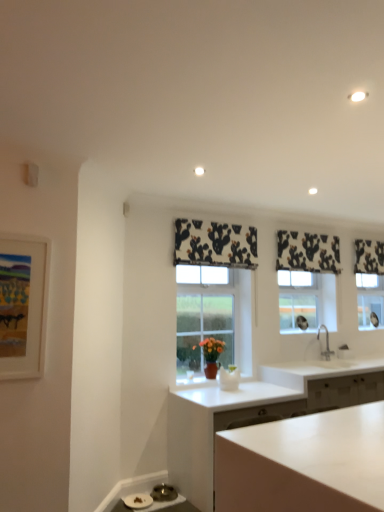
Question: From the image's perspective, is silver metallic faucet at right above matte white picture frame at left?

Choices:
 (A) yes
 (B) no

Answer: (B)

Question: Is silver metallic faucet at right positioned before matte white picture frame at left?

Choices:
 (A) yes
 (B) no

Answer: (B)

Question: From a real-world perspective, is silver metallic faucet at right located beneath matte white picture frame at left?

Choices:
 (A) no
 (B) yes

Answer: (B)

Question: Is silver metallic faucet at right looking in the opposite direction of matte white picture frame at left?

Choices:
 (A) yes
 (B) no

Answer: (B)

Question: From a real-world perspective, is silver metallic faucet at right over matte white picture frame at left?

Choices:
 (A) yes
 (B) no

Answer: (B)

Question: Considering the relative sizes of silver metallic faucet at right and matte white picture frame at left in the image provided, is silver metallic faucet at right taller than matte white picture frame at left?

Choices:
 (A) no
 (B) yes

Answer: (A)

Question: Is silver metallic faucet at right turned away from black printed fabric at upper center, arranged as the third curtain when viewed from the right?

Choices:
 (A) yes
 (B) no

Answer: (B)

Question: Considering the relative sizes of silver metallic faucet at right and black printed fabric at upper center, which is the 3th curtain from back to front, in the image provided, is silver metallic faucet at right wider than black printed fabric at upper center, which is the 3th curtain from back to front,?

Choices:
 (A) no
 (B) yes

Answer: (B)

Question: Would you say silver metallic faucet at right is outside black printed fabric at upper center, which is the 3th curtain from back to front?

Choices:
 (A) yes
 (B) no

Answer: (A)

Question: Considering the relative sizes of silver metallic faucet at right and black printed fabric at upper center, which is the 1th curtain from left to right, in the image provided, is silver metallic faucet at right thinner than black printed fabric at upper center, which is the 1th curtain from left to right,?

Choices:
 (A) no
 (B) yes

Answer: (A)

Question: Are silver metallic faucet at right and black printed fabric at upper center, which is the 1th curtain from left to right, beside each other?

Choices:
 (A) yes
 (B) no

Answer: (B)

Question: Does silver metallic faucet at right appear on the left side of black printed fabric at upper center, the 1th curtain from the front?

Choices:
 (A) no
 (B) yes

Answer: (A)

Question: Does black printed fabric at upper center, the 1th curtain from the front, have a lesser width compared to black and white fabric at upper right, the third curtain viewed from the front?

Choices:
 (A) yes
 (B) no

Answer: (B)